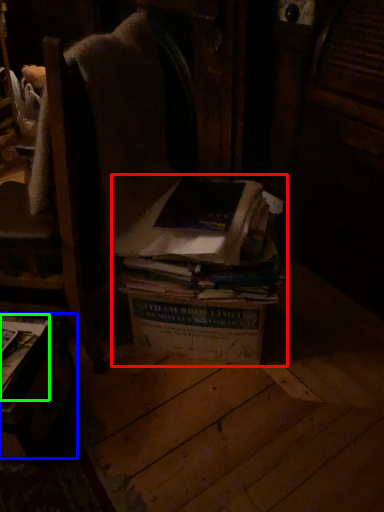
Question: Which object is the farthest from book (highlighted by a red box)? Choose among these: table (highlighted by a blue box) or book (highlighted by a green box).

Choices:
 (A) table
 (B) book

Answer: (B)